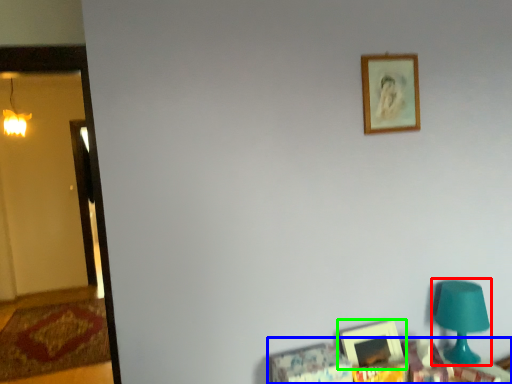
Question: Which is nearer to the table lamp (highlighted by a red box)? furniture (highlighted by a blue box) or picture frame (highlighted by a green box).

Choices:
 (A) furniture
 (B) picture frame

Answer: (A)